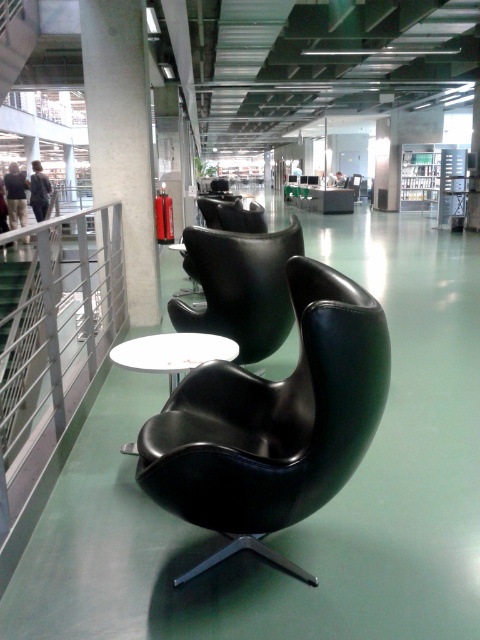
Question: Is matte black swivel chair at center thinner than white glossy round table at center?

Choices:
 (A) yes
 (B) no

Answer: (B)

Question: Can you confirm if matte black swivel chair at center is positioned to the left of black leather armchair at center?

Choices:
 (A) no
 (B) yes

Answer: (A)

Question: Based on their relative distances, which object is farther from the white glossy round table at center?

Choices:
 (A) matte black swivel chair at center
 (B) black leather armchair at center

Answer: (B)

Question: Which of the following is the closest to the observer?

Choices:
 (A) (192, 276)
 (B) (113, 362)

Answer: (B)

Question: Does matte black swivel chair at center appear on the left side of black leather armchair at center?

Choices:
 (A) yes
 (B) no

Answer: (B)

Question: Among these objects, which one is nearest to the camera?

Choices:
 (A) white glossy round table at center
 (B) black leather armchair at center
 (C) matte black swivel chair at center

Answer: (C)